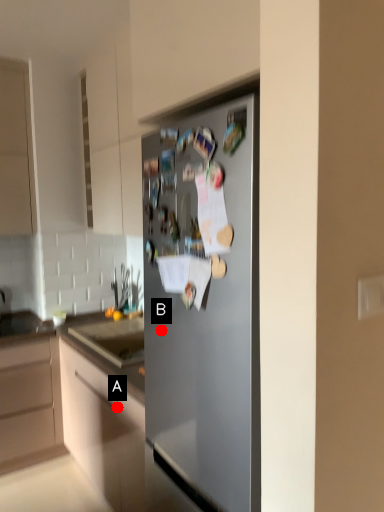
Question: Two points are circled on the image, labeled by A and B beside each circle. Among these points, which one is nearest to the camera?

Choices:
 (A) A is closer
 (B) B is closer

Answer: (B)